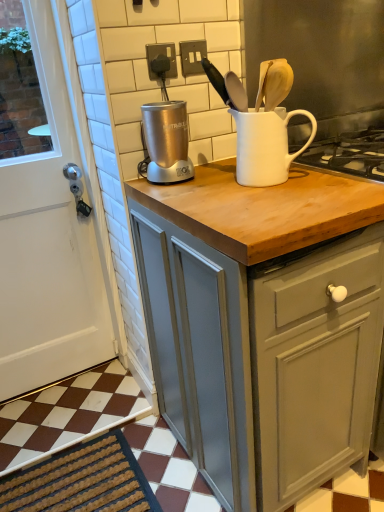
I want to click on free point in front of white ceramic jug at upper center, so click(278, 194).